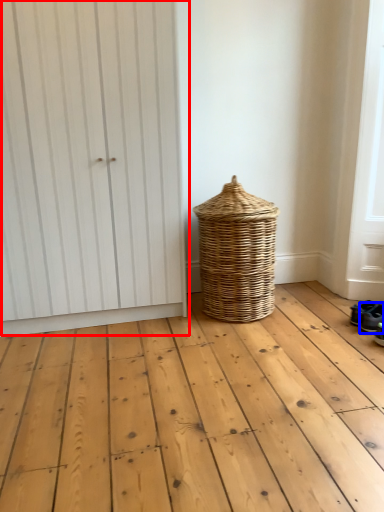
Question: Which point is closer to the camera, door (highlighted by a red box) or footwear (highlighted by a blue box)?

Choices:
 (A) door
 (B) footwear

Answer: (A)